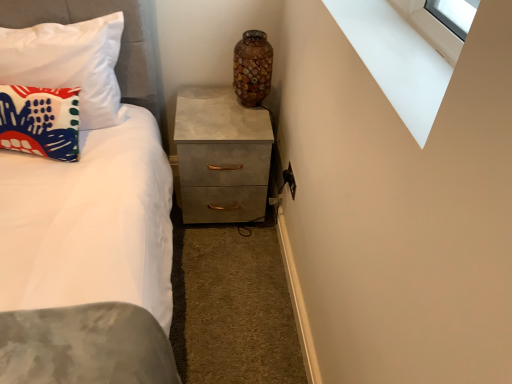
What is the approximate width of matte fabric pillow at left, which is counted as the 2th pillow, starting from the top?

matte fabric pillow at left, which is counted as the 2th pillow, starting from the top, is 7.50 inches wide.

The width and height of the screenshot is (512, 384). What do you see at coordinates (221, 156) in the screenshot? I see `matte concrete chest of drawers at center` at bounding box center [221, 156].

This screenshot has width=512, height=384. I want to click on matte concrete chest of drawers at center, so click(x=221, y=156).

At what (x,y) coordinates should I click in order to perform the action: click on white smooth window sill at upper right. Please return your answer as a coordinate pair (x, y). Looking at the image, I should click on (396, 60).

At what (x,y) coordinates should I click in order to perform the action: click on mosaic glass vase at upper center. Please return your answer as a coordinate pair (x, y). The height and width of the screenshot is (384, 512). Looking at the image, I should click on (252, 68).

Can you tell me how much white smooth window sill at upper right and matte fabric pillow at left, which ranks as the 1th pillow in bottom-to-top order, differ in facing direction?

They differ by 79.6 degrees in their facing directions.

From the image's perspective, which one is positioned higher, white smooth window sill at upper right or matte fabric pillow at left, which is counted as the 2th pillow, starting from the top?

white smooth window sill at upper right appears higher in the image.

Is matte fabric pillow at left, which is counted as the 2th pillow, starting from the top, at the back of white smooth window sill at upper right?

No.

Based on the photo, from a real-world perspective, does white smooth window sill at upper right stand above matte fabric pillow at left, which is counted as the 2th pillow, starting from the top?

Correct, in the physical world, white smooth window sill at upper right is higher than matte fabric pillow at left, which is counted as the 2th pillow, starting from the top.

Is matte concrete chest of drawers at center looking in the opposite direction of matte fabric pillow at left, which is counted as the 2th pillow, starting from the top?

That's not correct — matte concrete chest of drawers at center is not looking away from matte fabric pillow at left, which is counted as the 2th pillow, starting from the top.

Who is more distant, matte concrete chest of drawers at center or matte fabric pillow at left, which is counted as the 2th pillow, starting from the top?

matte concrete chest of drawers at center.

Is matte concrete chest of drawers at center directly adjacent to matte fabric pillow at left, which is counted as the 2th pillow, starting from the top?

No.

Is matte concrete chest of drawers at center bigger than matte fabric pillow at left, which is counted as the 2th pillow, starting from the top?

Indeed, matte concrete chest of drawers at center has a larger size compared to matte fabric pillow at left, which is counted as the 2th pillow, starting from the top.

Is matte fabric pillow at left, which ranks as the 1th pillow in bottom-to-top order, closer to the viewer compared to matte concrete chest of drawers at center?

Yes, matte fabric pillow at left, which ranks as the 1th pillow in bottom-to-top order, is closer to the camera.

Who is smaller, matte fabric pillow at left, which ranks as the 1th pillow in bottom-to-top order, or matte concrete chest of drawers at center?

Smaller between the two is matte fabric pillow at left, which ranks as the 1th pillow in bottom-to-top order.

Is matte fabric pillow at left, which ranks as the 1th pillow in bottom-to-top order, far away from matte concrete chest of drawers at center?

They are positioned close to each other.

Is mosaic glass vase at upper center situated inside matte fabric pillow at left, which is counted as the 2th pillow, starting from the top, or outside?

The correct answer is: outside.

Is there a large distance between mosaic glass vase at upper center and matte fabric pillow at left, which is counted as the 2th pillow, starting from the top?

Actually, mosaic glass vase at upper center and matte fabric pillow at left, which is counted as the 2th pillow, starting from the top, are a little close together.

Considering the positions of point (248, 31) and point (55, 119), is point (248, 31) closer or farther from the camera than point (55, 119)?

Clearly, point (248, 31) is more distant from the camera than point (55, 119).

Considering the positions of objects mosaic glass vase at upper center and matte fabric pillow at left, which is counted as the 2th pillow, starting from the top, in the image provided, who is more to the left, mosaic glass vase at upper center or matte fabric pillow at left, which is counted as the 2th pillow, starting from the top,?

matte fabric pillow at left, which is counted as the 2th pillow, starting from the top, is more to the left.

Who is smaller, matte fabric pillow at left, acting as the first pillow starting from the top, or white smooth window sill at upper right?

white smooth window sill at upper right.

Considering the sizes of objects matte fabric pillow at left, acting as the 2th pillow starting from the bottom, and white smooth window sill at upper right in the image provided, who is thinner, matte fabric pillow at left, acting as the 2th pillow starting from the bottom, or white smooth window sill at upper right?

With smaller width is white smooth window sill at upper right.

Is matte fabric pillow at left, acting as the 2th pillow starting from the bottom, spatially inside white smooth window sill at upper right, or outside of it?

matte fabric pillow at left, acting as the 2th pillow starting from the bottom, cannot be found inside white smooth window sill at upper right.

Does matte concrete chest of drawers at center contain mosaic glass vase at upper center?

No, matte concrete chest of drawers at center does not contain mosaic glass vase at upper center.

From the image's perspective, between matte concrete chest of drawers at center and mosaic glass vase at upper center, which one is located above?

mosaic glass vase at upper center.

Is matte concrete chest of drawers at center oriented away from mosaic glass vase at upper center?

No, matte concrete chest of drawers at center's orientation is not away from mosaic glass vase at upper center.

Does matte concrete chest of drawers at center lie behind mosaic glass vase at upper center?

Yes, matte concrete chest of drawers at center is behind mosaic glass vase at upper center.

Does mosaic glass vase at upper center touch white smooth window sill at upper right?

There is a gap between mosaic glass vase at upper center and white smooth window sill at upper right.

Is mosaic glass vase at upper center smaller than white smooth window sill at upper right?

Actually, mosaic glass vase at upper center might be larger than white smooth window sill at upper right.

How different are the orientations of mosaic glass vase at upper center and white smooth window sill at upper right in degrees?

88.3 degrees separate the facing orientations of mosaic glass vase at upper center and white smooth window sill at upper right.

From a real-world perspective, between mosaic glass vase at upper center and white smooth window sill at upper right, who is vertically higher?

white smooth window sill at upper right.

Find the location of a particular element. The height and width of the screenshot is (384, 512). pillow lying below the white smooth window sill at upper right (from the image's perspective) is located at coordinates (40, 121).

Locate an element on the screen. This screenshot has height=384, width=512. the 2nd pillow counting from the left side of the matte concrete chest of drawers at center is located at coordinates (40, 121).

Looking at the image, which one is located further to white smooth window sill at upper right, mosaic glass vase at upper center or matte fabric pillow at left, acting as the 2th pillow starting from the bottom?

matte fabric pillow at left, acting as the 2th pillow starting from the bottom, is positioned further to the anchor white smooth window sill at upper right.

Considering their positions, is matte fabric pillow at left, acting as the 2th pillow starting from the bottom, positioned further to matte fabric pillow at left, which ranks as the 1th pillow in bottom-to-top order, than mosaic glass vase at upper center?

mosaic glass vase at upper center.

Looking at the image, which one is located closer to matte concrete chest of drawers at center, matte fabric pillow at left, which is counted as the 2th pillow, starting from the top, or white smooth window sill at upper right?

matte fabric pillow at left, which is counted as the 2th pillow, starting from the top, is closer to matte concrete chest of drawers at center.

From the image, which object appears to be nearer to matte fabric pillow at left, which ranks as the 1th pillow in bottom-to-top order, matte concrete chest of drawers at center or matte fabric pillow at left, acting as the first pillow starting from the top?

matte fabric pillow at left, acting as the first pillow starting from the top, lies closer to matte fabric pillow at left, which ranks as the 1th pillow in bottom-to-top order, than the other object.

Looking at the image, which one is located further to matte fabric pillow at left, acting as the 2th pillow starting from the bottom, white smooth window sill at upper right or mosaic glass vase at upper center?

Based on the image, white smooth window sill at upper right appears to be further to matte fabric pillow at left, acting as the 2th pillow starting from the bottom.

Considering their positions, is white smooth window sill at upper right positioned closer to matte concrete chest of drawers at center than matte fabric pillow at left, which ranks as the 1th pillow in bottom-to-top order?

Based on the image, matte fabric pillow at left, which ranks as the 1th pillow in bottom-to-top order, appears to be nearer to matte concrete chest of drawers at center.

Looking at this image, based on their spatial positions, is matte concrete chest of drawers at center or white smooth window sill at upper right further from mosaic glass vase at upper center?

white smooth window sill at upper right lies further to mosaic glass vase at upper center than the other object.

When comparing their distances from matte fabric pillow at left, which is counted as the 2th pillow, starting from the top, does matte concrete chest of drawers at center or mosaic glass vase at upper center seem further?

Based on the image, mosaic glass vase at upper center appears to be further to matte fabric pillow at left, which is counted as the 2th pillow, starting from the top.

Identify the location of vase between matte fabric pillow at left, acting as the first pillow starting from the top, and white smooth window sill at upper right from left to right. The height and width of the screenshot is (384, 512). (252, 68).

I want to click on vase positioned between white smooth window sill at upper right and matte concrete chest of drawers at center from near to far, so click(252, 68).

Find the location of a particular element. The width and height of the screenshot is (512, 384). pillow between matte fabric pillow at left, which ranks as the 1th pillow in bottom-to-top order, and white smooth window sill at upper right, in the horizontal direction is located at coordinates (69, 63).

The image size is (512, 384). I want to click on pillow between matte fabric pillow at left, which ranks as the 1th pillow in bottom-to-top order, and matte concrete chest of drawers at center, in the horizontal direction, so click(x=69, y=63).